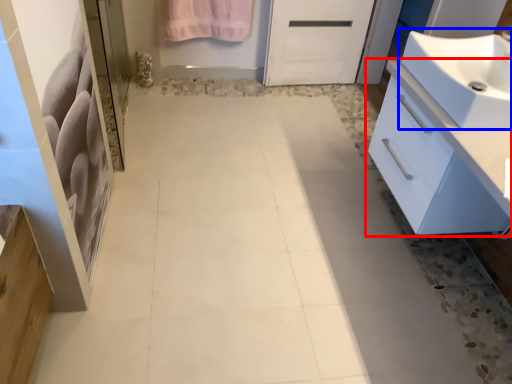
Question: Which object appears closest to the camera in this image, bathroom cabinet (highlighted by a red box) or sink (highlighted by a blue box)?

Choices:
 (A) bathroom cabinet
 (B) sink

Answer: (A)